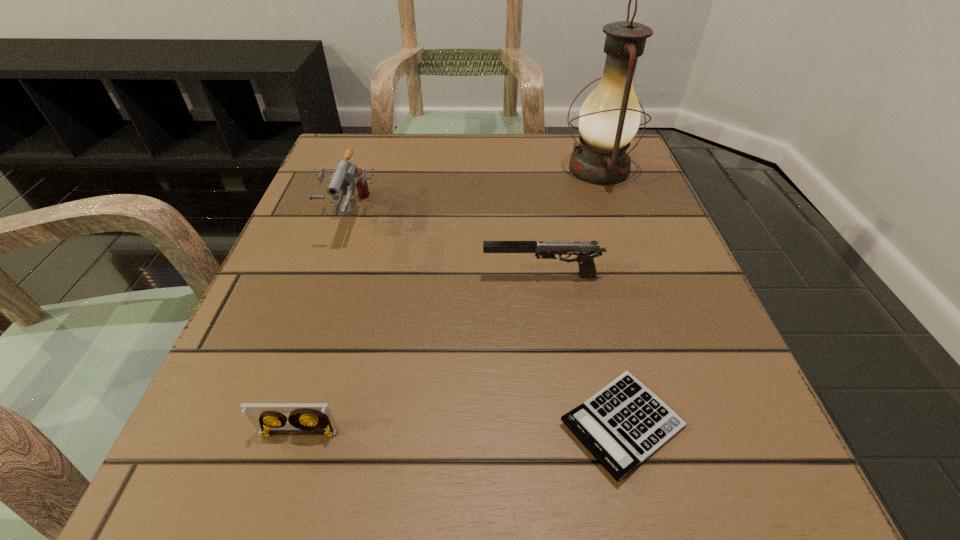
The image size is (960, 540). Find the location of `free space between the third tallest object and the taller gun`. free space between the third tallest object and the taller gun is located at coordinates (445, 246).

I want to click on empty location between the third nearest object and the fourth tallest object, so click(420, 354).

The width and height of the screenshot is (960, 540). I want to click on vacant point located between the shortest object and the third nearest object, so click(582, 350).

Where is `free point between the third shortest object and the shortest object`? free point between the third shortest object and the shortest object is located at coordinates (582, 350).

At what (x,y) coordinates should I click in order to perform the action: click on free spot between the shortest object and the taller gun. Please return your answer as a coordinate pair (x, y). The height and width of the screenshot is (540, 960). Looking at the image, I should click on (486, 320).

Where is `vacant area that lies between the second tallest object and the shortest object`? The image size is (960, 540). vacant area that lies between the second tallest object and the shortest object is located at coordinates (486, 320).

Where is `vacant space that's between the fourth tallest object and the shortest object`? vacant space that's between the fourth tallest object and the shortest object is located at coordinates click(x=461, y=428).

Locate an element on the screen. The height and width of the screenshot is (540, 960). object that ranks as the second closest to the oil lamp is located at coordinates (346, 174).

Locate an element on the screen. This screenshot has width=960, height=540. object that stands as the closest to the second shortest object is located at coordinates (623, 424).

This screenshot has height=540, width=960. Identify the location of free space that satisfies the following two spatial constraints: 1. at the barrel end of the left gun; 2. on the right side of the shortest object. (278, 424).